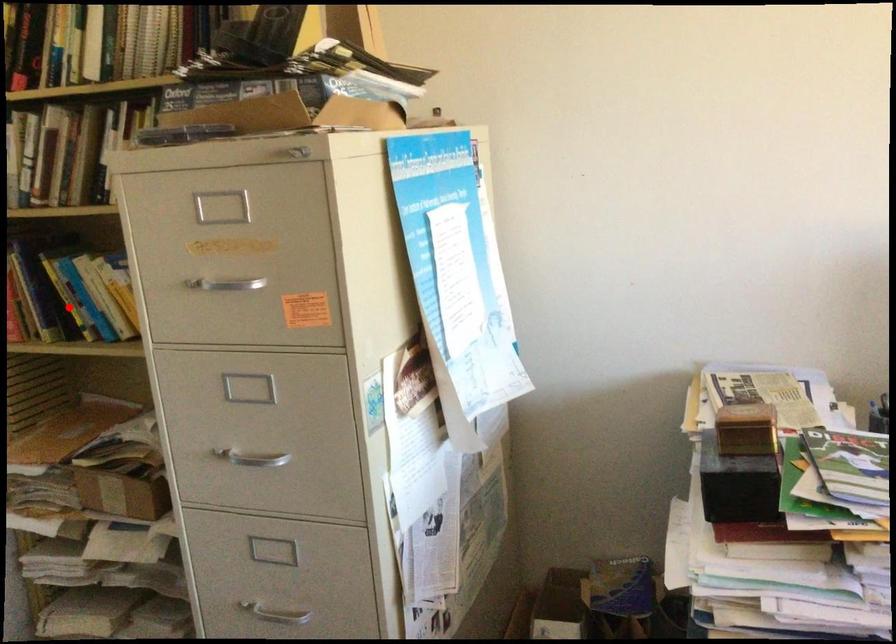
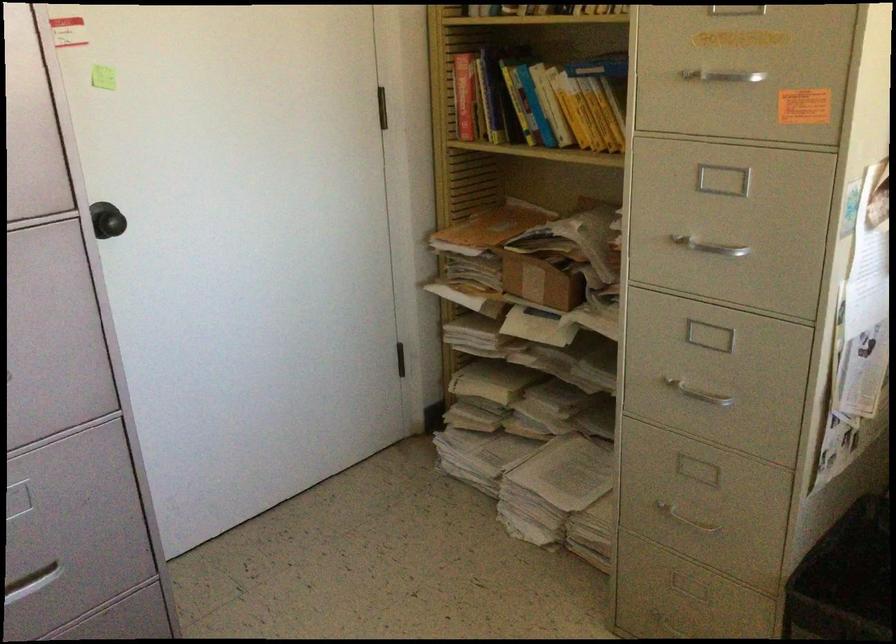
Question: I am providing you with two images of the same scene from different viewpoints. A red point is shown in image1. For the corresponding object point in image2, is it positioned nearer or farther from the camera?

Choices:
 (A) Nearer
 (B) Farther

Answer: (B)